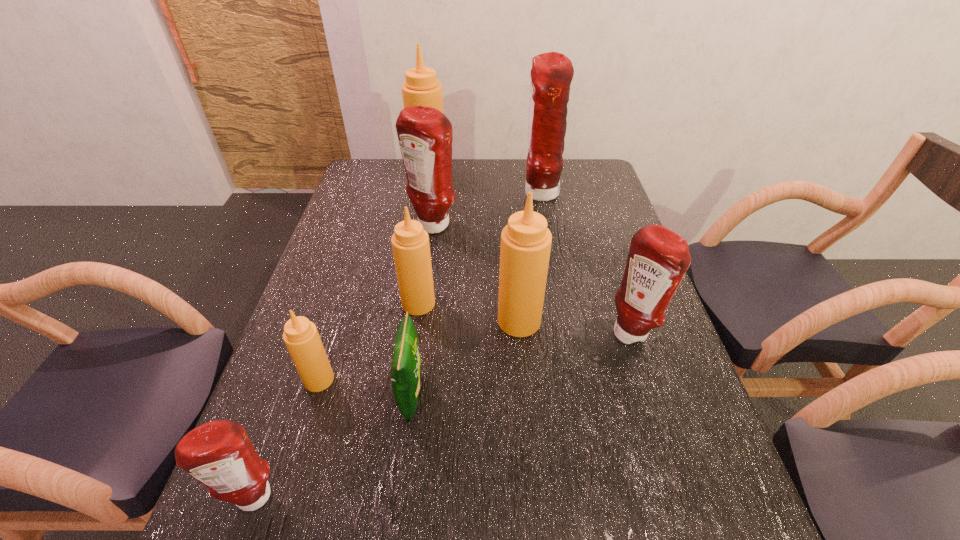
What are the coordinates of `unoccupied area between the farthest red condiment and the third farthest object` in the screenshot? It's located at (486, 211).

The height and width of the screenshot is (540, 960). Identify the location of free space between the nearest object and the biggest tan condiment. (343, 336).

Where is `free spot between the third biggest tan condiment and the smallest red condiment`? Image resolution: width=960 pixels, height=540 pixels. free spot between the third biggest tan condiment and the smallest red condiment is located at coordinates 337,400.

You are a GUI agent. You are given a task and a screenshot of the screen. Output one action in this format:
    pyautogui.click(x=<x>, y=<y>)
    Task: Click on the blank region between the nearest tan condiment and the rightmost object
    The image size is (960, 540).
    Given the screenshot: What is the action you would take?
    pyautogui.click(x=475, y=356)

The image size is (960, 540). What are the coordinates of `empty space between the rightmost tan condiment and the farthest tan condiment` in the screenshot? It's located at (474, 248).

The height and width of the screenshot is (540, 960). In order to click on free spot between the second nearest condiment and the rightmost tan condiment in this screenshot , I will do `click(420, 350)`.

Where is `object that stands as the fourth closest to the farthest red condiment`? This screenshot has height=540, width=960. object that stands as the fourth closest to the farthest red condiment is located at coordinates (410, 242).

Locate which object is the third closest to the smallest tan condiment. Please provide its 2D coordinates. Your answer should be formatted as a tuple, i.e. [(x, y)], where the tuple contains the x and y coordinates of a point satisfying the conditions above.

[(410, 242)]

Identify which condiment is the fifth nearest to the biggest tan condiment. Please provide its 2D coordinates. Your answer should be formatted as a tuple, i.e. [(x, y)], where the tuple contains the x and y coordinates of a point satisfying the conditions above.

[(658, 259)]

You are a GUI agent. You are given a task and a screenshot of the screen. Output one action in this format:
    pyautogui.click(x=<x>, y=<y>)
    Task: Click on the condiment object that ranks as the second closest to the rightmost red condiment
    This screenshot has height=540, width=960.
    Given the screenshot: What is the action you would take?
    pyautogui.click(x=410, y=242)